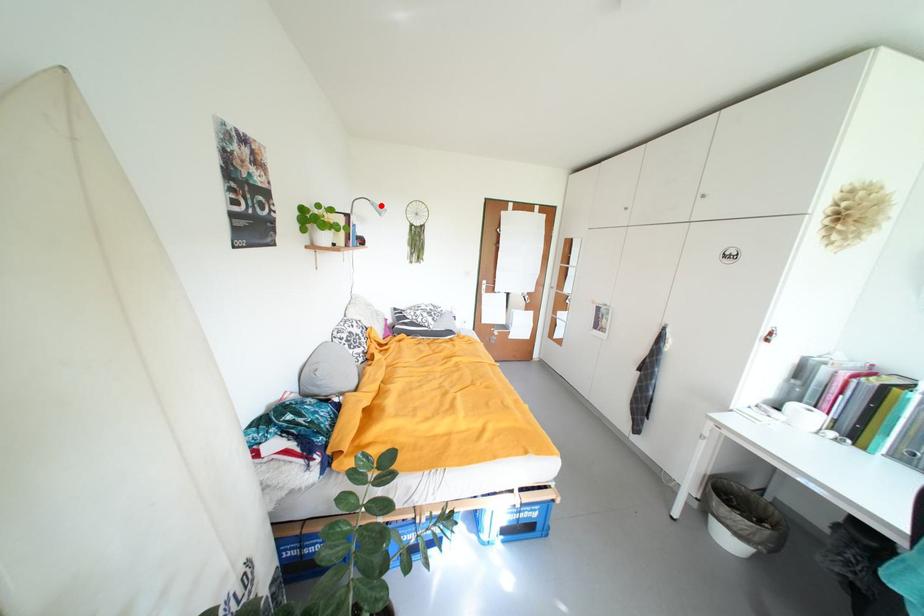
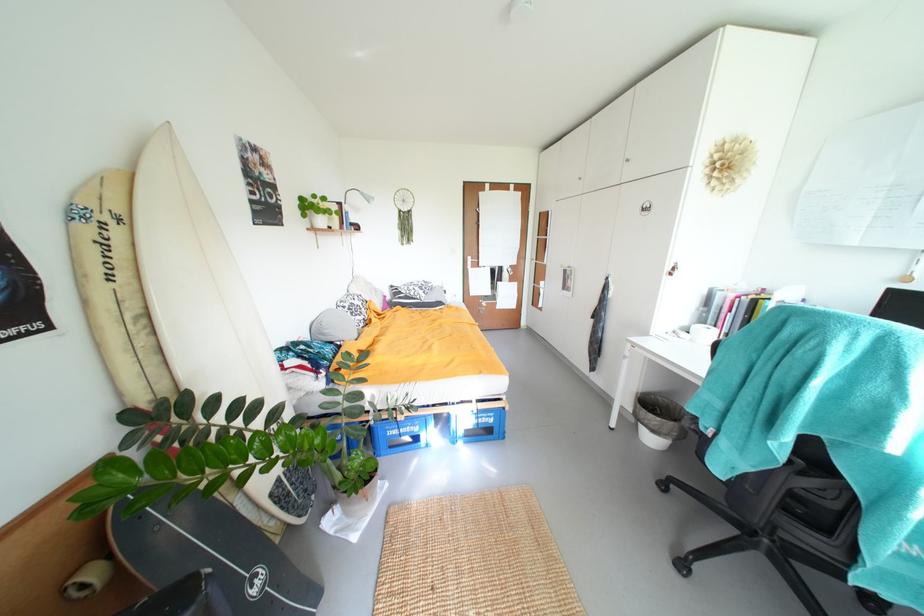
The point at the highlighted location is marked in the first image. Where is the corresponding point in the second image?

(370, 196)